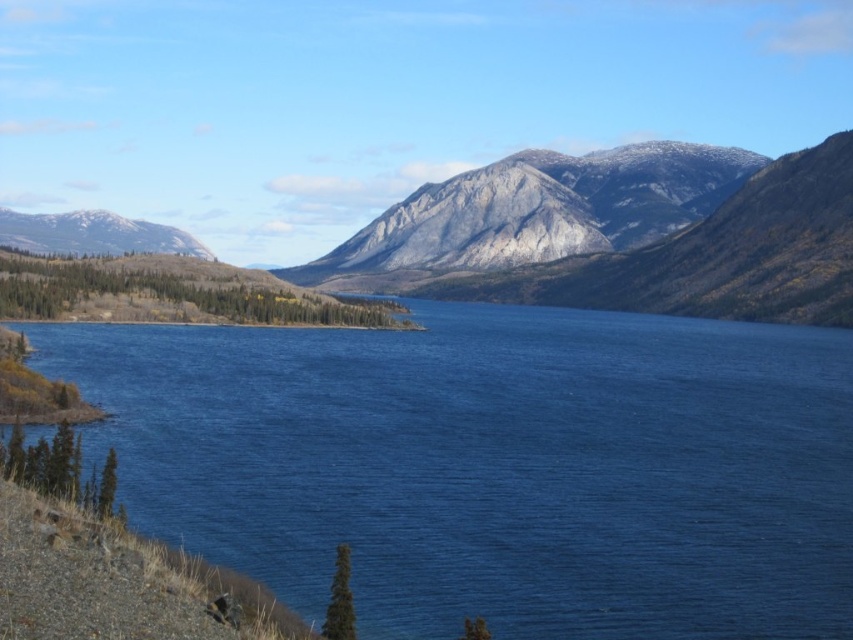
Question: Does blue liquid water at center appear over gray rocky mountain at left?

Choices:
 (A) no
 (B) yes

Answer: (A)

Question: Which of the following is the farthest from the observer?

Choices:
 (A) (572, 598)
 (B) (73, 250)

Answer: (B)

Question: Is blue liquid water at center wider than gray rocky mountain at left?

Choices:
 (A) no
 (B) yes

Answer: (A)

Question: Which point is farther from the camera taking this photo?

Choices:
 (A) (758, 609)
 (B) (61, 237)

Answer: (B)

Question: Where is blue liquid water at center located in relation to gray rocky mountain at left in the image?

Choices:
 (A) below
 (B) above

Answer: (A)

Question: Which point is closer to the camera?

Choices:
 (A) (155, 244)
 (B) (688, 317)

Answer: (B)